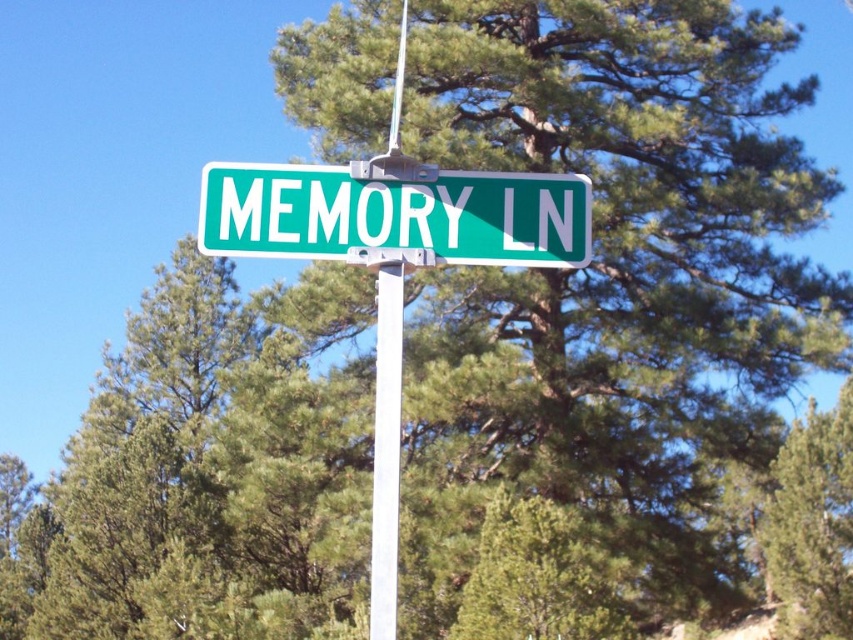
Does green metallic street sign at center appear under white smooth pole at center?

No, green metallic street sign at center is not below white smooth pole at center.

Is green metallic street sign at center behind white smooth pole at center?

Yes, it is behind white smooth pole at center.

This screenshot has width=853, height=640. In order to click on green metallic street sign at center in this screenshot , I will do `click(395, 216)`.

The height and width of the screenshot is (640, 853). Find the location of `green metallic street sign at center`. green metallic street sign at center is located at coordinates (395, 216).